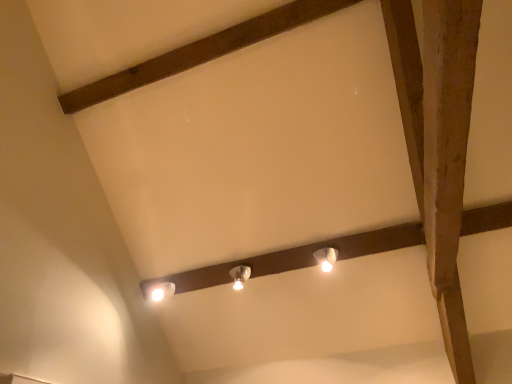
Question: Should I look upward or downward to see white glossy lamp at center, the 2th lamp viewed from the front?

Choices:
 (A) down
 (B) up

Answer: (A)

Question: Does brown wooden plank at upper center have a greater height compared to white glossy lamp at center, the 2th lamp viewed from the front?

Choices:
 (A) no
 (B) yes

Answer: (A)

Question: Is brown wooden plank at upper center closer to the viewer compared to white glossy lamp at center, which is counted as the 1th lamp, starting from the left?

Choices:
 (A) no
 (B) yes

Answer: (B)

Question: Could you tell me if brown wooden plank at upper center is turned towards white glossy lamp at center, the 2th lamp viewed from the front?

Choices:
 (A) yes
 (B) no

Answer: (B)

Question: Does brown wooden plank at upper center have a lesser width compared to white glossy lamp at center, the 2th lamp viewed from the front?

Choices:
 (A) yes
 (B) no

Answer: (A)

Question: Considering the relative sizes of brown wooden plank at upper center and white glossy lamp at center, the 2th lamp viewed from the front, in the image provided, is brown wooden plank at upper center smaller than white glossy lamp at center, the 2th lamp viewed from the front,?

Choices:
 (A) no
 (B) yes

Answer: (A)

Question: Considering the relative positions of brown wooden plank at upper center and white glossy lamp at center, which is counted as the 1th lamp, starting from the back, in the image provided, is brown wooden plank at upper center to the left of white glossy lamp at center, which is counted as the 1th lamp, starting from the back, from the viewer's perspective?

Choices:
 (A) no
 (B) yes

Answer: (B)

Question: Is the depth of white glossy lamp at upper center, marked as the second lamp in a back-to-front arrangement, greater than that of brown wooden plank at upper center?

Choices:
 (A) no
 (B) yes

Answer: (B)

Question: Is white glossy lamp at upper center, the second lamp viewed from the left, positioned with its back to brown wooden plank at upper center?

Choices:
 (A) yes
 (B) no

Answer: (B)

Question: Considering the relative positions of white glossy lamp at upper center, the second lamp viewed from the left, and brown wooden plank at upper center in the image provided, is white glossy lamp at upper center, the second lamp viewed from the left, in front of brown wooden plank at upper center?

Choices:
 (A) yes
 (B) no

Answer: (B)

Question: Is brown wooden plank at upper center inside white glossy lamp at upper center, which appears as the 1th lamp when viewed from the right?

Choices:
 (A) no
 (B) yes

Answer: (A)

Question: From the image's perspective, is white glossy lamp at upper center, the second lamp viewed from the left, over brown wooden plank at upper center?

Choices:
 (A) no
 (B) yes

Answer: (A)

Question: From the image's perspective, is white glossy lamp at upper center, marked as the second lamp in a back-to-front arrangement, below brown wooden plank at upper center?

Choices:
 (A) no
 (B) yes

Answer: (B)

Question: Is white glossy lamp at upper center, the second lamp viewed from the left, taller than white glossy lamp at center, which appears as the 2th lamp when viewed from the right?

Choices:
 (A) no
 (B) yes

Answer: (A)